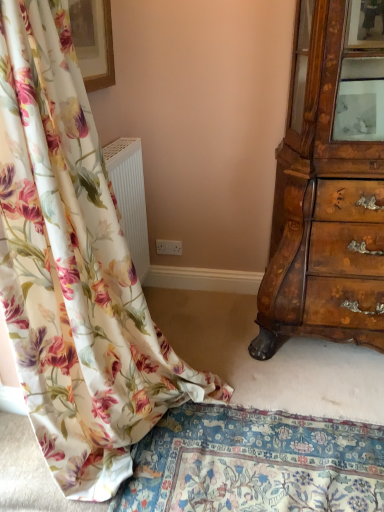
The image size is (384, 512). Describe the element at coordinates (93, 41) in the screenshot. I see `wooden picture frame at upper left` at that location.

In order to face wooden picture frame at upper left, should I rotate leftwards or rightwards?

It's best to rotate left around 13.831 degrees.

Where is `wooden picture frame at upper left`? This screenshot has height=512, width=384. wooden picture frame at upper left is located at coordinates (93, 41).

Measure the distance between point (133, 360) and camera.

Point (133, 360) and camera are 1.45 meters apart.

This screenshot has width=384, height=512. What do you see at coordinates (74, 270) in the screenshot?
I see `floral fabric curtain at left` at bounding box center [74, 270].

Identify the location of floral fabric curtain at left. The height and width of the screenshot is (512, 384). (74, 270).

Locate an element on the screen. The height and width of the screenshot is (512, 384). wooden picture frame at upper left is located at coordinates 93,41.

Consider the image. Visually, is wooden picture frame at upper left positioned to the left or to the right of floral fabric curtain at left?

From the image, it's evident that wooden picture frame at upper left is to the left of floral fabric curtain at left.

In the image, is wooden picture frame at upper left positioned in front of or behind floral fabric curtain at left?

wooden picture frame at upper left is positioned farther from the viewer than floral fabric curtain at left.

Does point (88, 28) come in front of point (188, 374)?

That is False.

From the image's perspective, which is below, wooden picture frame at upper left or floral fabric curtain at left?

floral fabric curtain at left.

From a real-world perspective, is wooden picture frame at upper left positioned above or below floral fabric curtain at left?

From a real-world perspective, wooden picture frame at upper left is physically above floral fabric curtain at left.

In terms of width, does wooden picture frame at upper left look wider or thinner when compared to floral fabric curtain at left?

Considering their sizes, wooden picture frame at upper left looks slimmer than floral fabric curtain at left.

Can you confirm if wooden picture frame at upper left is taller than floral fabric curtain at left?

No, wooden picture frame at upper left is not taller than floral fabric curtain at left.

Can you confirm if wooden picture frame at upper left is smaller than floral fabric curtain at left?

Correct, wooden picture frame at upper left occupies less space than floral fabric curtain at left.

In the scene shown: Which is correct: wooden picture frame at upper left is inside floral fabric curtain at left, or outside of it?

wooden picture frame at upper left cannot be found inside floral fabric curtain at left.

Is wooden picture frame at upper left positioned far away from floral fabric curtain at left?

No, wooden picture frame at upper left is in close proximity to floral fabric curtain at left.

Is wooden picture frame at upper left turned away from floral fabric curtain at left?

wooden picture frame at upper left is not turned away from floral fabric curtain at left.

Image resolution: width=384 pixels, height=512 pixels. I want to click on curtain located underneath the wooden picture frame at upper left (from a real-world perspective), so click(74, 270).

Is floral fabric curtain at left to the left of wooden picture frame at upper left from the viewer's perspective?

In fact, floral fabric curtain at left is to the right of wooden picture frame at upper left.

Is floral fabric curtain at left further to the viewer compared to wooden picture frame at upper left?

No, it is not.

Is point (69, 393) positioned in front of point (83, 54)?

Yes, it is in front of point (83, 54).

Consider the image. From the image's perspective, is floral fabric curtain at left located above or below wooden picture frame at upper left?

Clearly, from the image's perspective, floral fabric curtain at left is below wooden picture frame at upper left.

From a real-world perspective, is floral fabric curtain at left positioned above or below wooden picture frame at upper left?

In terms of real-world spatial position, floral fabric curtain at left is below wooden picture frame at upper left.

Looking at their sizes, would you say floral fabric curtain at left is wider or thinner than wooden picture frame at upper left?

In the image, floral fabric curtain at left appears to be wider than wooden picture frame at upper left.

From their relative heights in the image, would you say floral fabric curtain at left is taller or shorter than wooden picture frame at upper left?

In the image, floral fabric curtain at left appears to be taller than wooden picture frame at upper left.

Is floral fabric curtain at left smaller than wooden picture frame at upper left?

No.

Is floral fabric curtain at left positioned beyond the bounds of wooden picture frame at upper left?

Yes.

Is floral fabric curtain at left not near wooden picture frame at upper left?

No, floral fabric curtain at left is not far away from wooden picture frame at upper left.

Is floral fabric curtain at left oriented away from wooden picture frame at upper left?

floral fabric curtain at left is not turned away from wooden picture frame at upper left.

Can you tell me how much floral fabric curtain at left and wooden picture frame at upper left differ in facing direction?

floral fabric curtain at left and wooden picture frame at upper left are facing 1.45 degrees away from each other.

How much distance is there between floral fabric curtain at left and wooden picture frame at upper left?

floral fabric curtain at left and wooden picture frame at upper left are 91.24 centimeters apart from each other.

You are a GUI agent. You are given a task and a screenshot of the screen. Output one action in this format:
    pyautogui.click(x=<x>, y=<y>)
    Task: Click on the curtain in front of the wooden picture frame at upper left
    The width and height of the screenshot is (384, 512).
    Given the screenshot: What is the action you would take?
    pyautogui.click(x=74, y=270)

Where is `curtain below the wooden picture frame at upper left (from a real-world perspective)`? This screenshot has width=384, height=512. curtain below the wooden picture frame at upper left (from a real-world perspective) is located at coordinates (74, 270).

Locate an element on the screen. picture frame behind the floral fabric curtain at left is located at coordinates (93, 41).